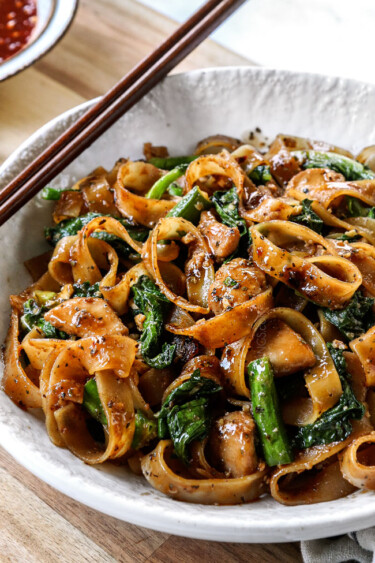
Locate an element on the screen. The image size is (375, 563). cloth napkin is located at coordinates (353, 549).